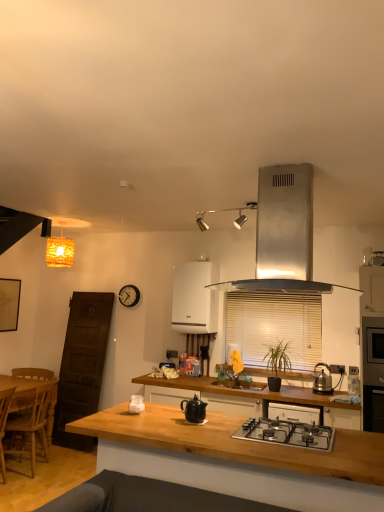
Question: Considering the relative sizes of wooden at center and orange woven lampshade at upper left in the image provided, is wooden at center shorter than orange woven lampshade at upper left?

Choices:
 (A) no
 (B) yes

Answer: (A)

Question: Does wooden at center have a greater width compared to orange woven lampshade at upper left?

Choices:
 (A) no
 (B) yes

Answer: (B)

Question: From the image's perspective, is wooden at center over orange woven lampshade at upper left?

Choices:
 (A) yes
 (B) no

Answer: (B)

Question: From a real-world perspective, is wooden at center located beneath orange woven lampshade at upper left?

Choices:
 (A) yes
 (B) no

Answer: (A)

Question: Would you say wooden at center contains orange woven lampshade at upper left?

Choices:
 (A) yes
 (B) no

Answer: (B)

Question: Is white glossy wall oven at center, the first kitchen appliance from the back, in front of or behind satin silver range hood at upper center, the second kitchen appliance from the right, in the image?

Choices:
 (A) behind
 (B) front

Answer: (A)

Question: From a real-world perspective, is white glossy wall oven at center, acting as the fifth kitchen appliance starting from the front, physically located above or below satin silver range hood at upper center, the second kitchen appliance from the right?

Choices:
 (A) above
 (B) below

Answer: (B)

Question: Considering the positions of point (187, 324) and point (268, 178), is point (187, 324) closer or farther from the camera than point (268, 178)?

Choices:
 (A) closer
 (B) farther

Answer: (B)

Question: From their relative heights in the image, would you say white glossy wall oven at center, the 3th kitchen appliance in the right-to-left sequence, is taller or shorter than satin silver range hood at upper center, acting as the 1th kitchen appliance starting from the front?

Choices:
 (A) tall
 (B) short

Answer: (A)

Question: Is black stainless steel oven at right wider or thinner than satin silver range hood at upper center, acting as the 1th kitchen appliance starting from the front?

Choices:
 (A) thin
 (B) wide

Answer: (B)

Question: From a real-world perspective, relative to satin silver range hood at upper center, the fourth kitchen appliance when ordered from left to right, is black stainless steel oven at right vertically above or below?

Choices:
 (A) above
 (B) below

Answer: (B)

Question: Considering the positions of black stainless steel oven at right and satin silver range hood at upper center, the 1th kitchen appliance from the top, in the image, is black stainless steel oven at right bigger or smaller than satin silver range hood at upper center, the 1th kitchen appliance from the top,?

Choices:
 (A) small
 (B) big

Answer: (B)

Question: In the image, is black stainless steel oven at right on the left side or the right side of satin silver range hood at upper center, acting as the 1th kitchen appliance starting from the front?

Choices:
 (A) right
 (B) left

Answer: (A)

Question: Considering the positions of white glossy jar at center, the third kitchen appliance when ordered from front to back, and black stainless steel oven at right in the image, is white glossy jar at center, the third kitchen appliance when ordered from front to back, taller or shorter than black stainless steel oven at right?

Choices:
 (A) short
 (B) tall

Answer: (A)

Question: Looking at their shapes, would you say white glossy jar at center, the third kitchen appliance when ordered from front to back, is wider or thinner than black stainless steel oven at right?

Choices:
 (A) wide
 (B) thin

Answer: (B)